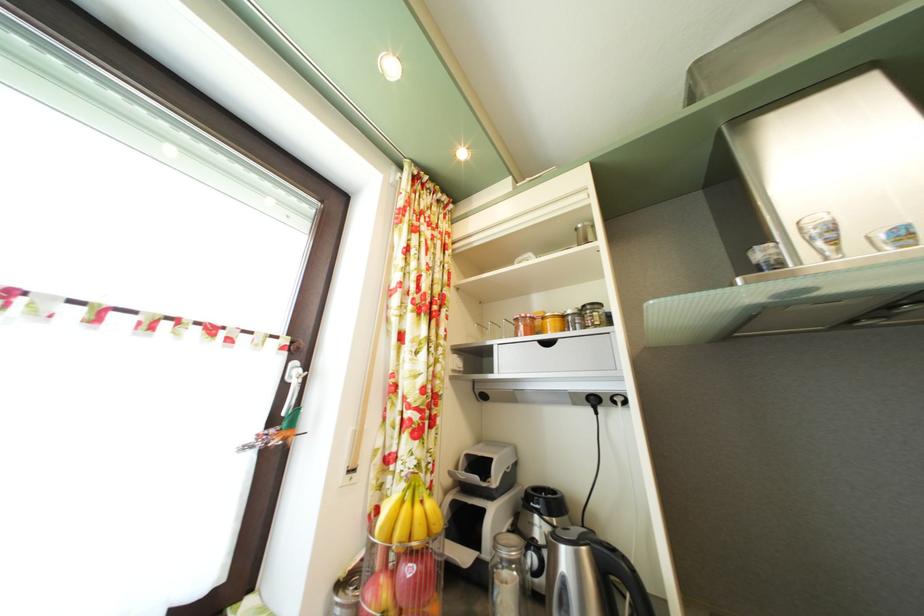
Image resolution: width=924 pixels, height=616 pixels. Find the location of `red apple`. red apple is located at coordinates (416, 578).